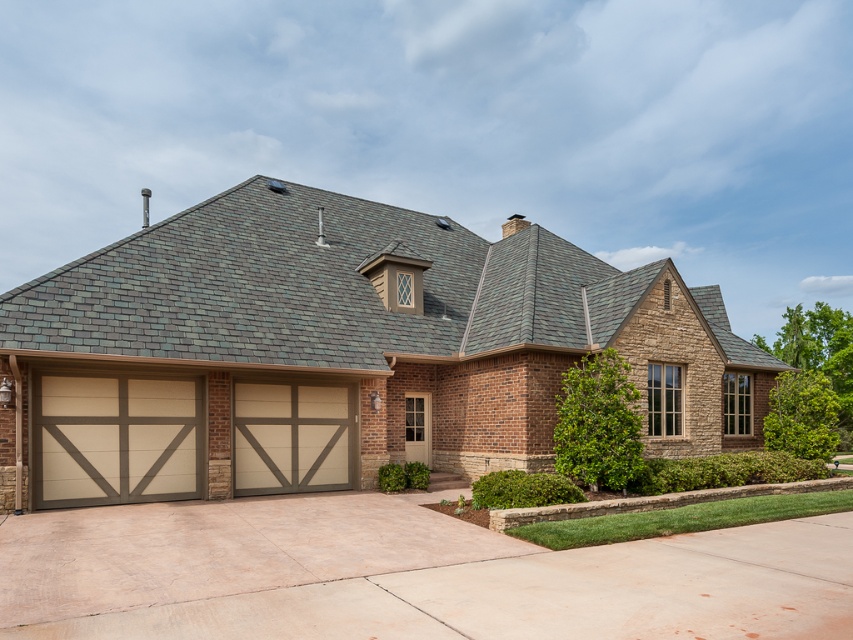
Question: In this image, where is beige wood garage doors at lower left located relative to beige wood-paneled garage door at lower left?

Choices:
 (A) left
 (B) right

Answer: (B)

Question: Can you confirm if beige wood garage doors at lower left is thinner than concrete at center?

Choices:
 (A) yes
 (B) no

Answer: (B)

Question: Which is nearer to the concrete at center?

Choices:
 (A) beige wood garage doors at lower left
 (B) beige wood garage door at center
 (C) beige wood-paneled garage door at lower left

Answer: (C)

Question: Which of these objects is positioned closest to the concrete at center?

Choices:
 (A) beige wood-paneled garage door at lower left
 (B) beige wood garage door at center

Answer: (A)

Question: Can you confirm if beige wood garage doors at lower left is bigger than concrete at center?

Choices:
 (A) no
 (B) yes

Answer: (B)

Question: Which of the following is the farthest from the observer?

Choices:
 (A) beige wood garage door at center
 (B) beige wood-paneled garage door at lower left
 (C) concrete at center
 (D) beige wood garage doors at lower left

Answer: (A)